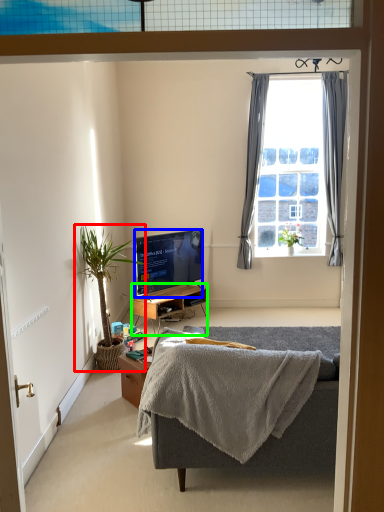
Question: Considering the real-world distances, which object is closest to houseplant (highlighted by a red box)? television (highlighted by a blue box) or desk (highlighted by a green box).

Choices:
 (A) television
 (B) desk

Answer: (A)